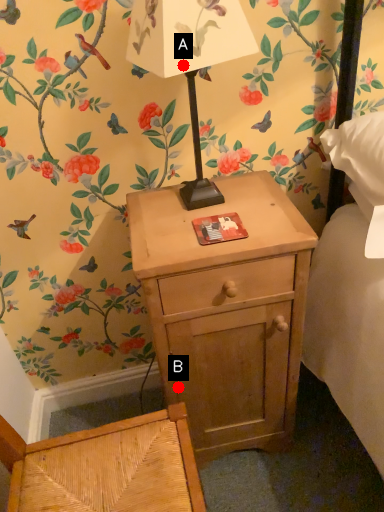
Question: Two points are circled on the image, labeled by A and B beside each circle. Among these points, which one is nearest to the camera?

Choices:
 (A) A is closer
 (B) B is closer

Answer: (A)